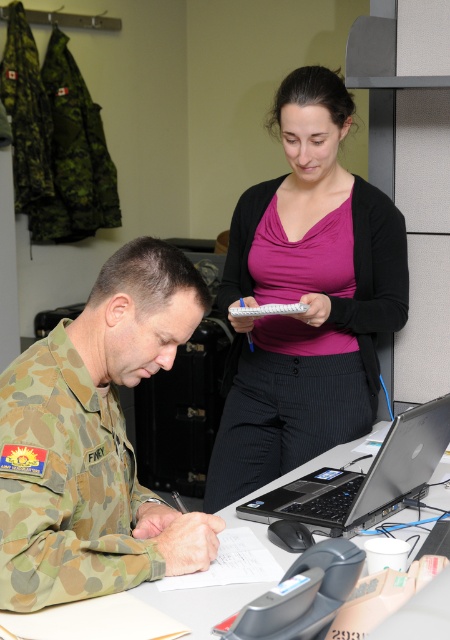
Question: Does pink matte sweater at center appear over white paper at center?

Choices:
 (A) yes
 (B) no

Answer: (A)

Question: From the image, what is the correct spatial relationship of camouflage uniform at center in relation to silver/black laptop at center?

Choices:
 (A) left
 (B) right

Answer: (A)

Question: Which point is farther to the camera?

Choices:
 (A) pink matte sweater at center
 (B) camouflage uniform at center
 (C) white paper at center
 (D) silver/black laptop at center

Answer: (A)

Question: Can you confirm if pink matte sweater at center is positioned to the right of camouflage uniform at center?

Choices:
 (A) yes
 (B) no

Answer: (A)

Question: Which point is farther from the camera taking this photo?

Choices:
 (A) (116, 445)
 (B) (260, 394)

Answer: (B)

Question: Which point appears closest to the camera in this image?

Choices:
 (A) (311, 516)
 (B) (302, 426)
 (C) (143, 340)
 (D) (211, 602)

Answer: (D)